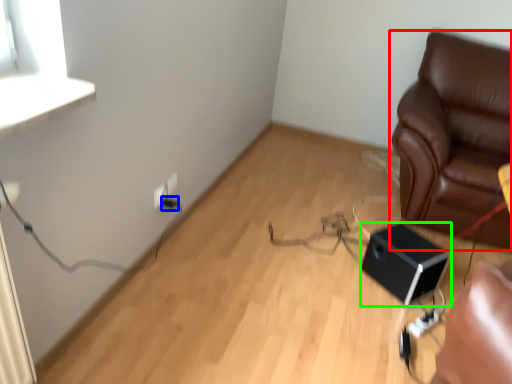
Question: Estimate the real-world distances between objects in this image. Which object is farther from furniture (highlighted by a red box), electric outlet (highlighted by a blue box) or speaker (highlighted by a green box)?

Choices:
 (A) electric outlet
 (B) speaker

Answer: (A)